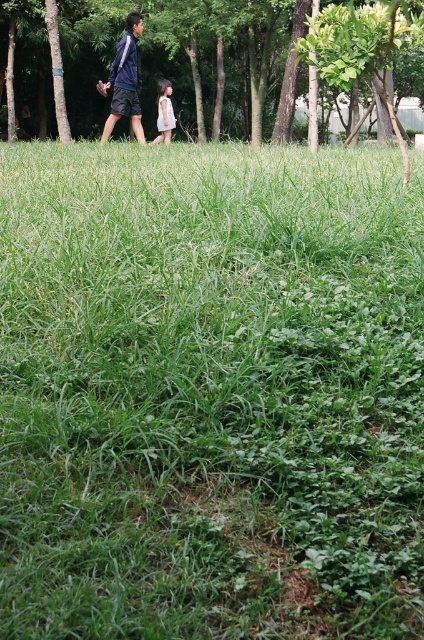
Is green leafy tree at upper center shorter than light pink fabric dress at center?

Correct, green leafy tree at upper center is not as tall as light pink fabric dress at center.

Does green leafy tree at upper center appear under light pink fabric dress at center?

No, green leafy tree at upper center is not below light pink fabric dress at center.

Who is more forward, (209, 80) or (162, 90)?

Point (162, 90) is in front.

This screenshot has width=424, height=640. Find the location of `green leafy tree at upper center`. green leafy tree at upper center is located at coordinates (156, 65).

Who is positioned more to the left, blue fabric jacket at upper left or light pink fabric dress at center?

blue fabric jacket at upper left is more to the left.

Identify the location of blue fabric jacket at upper left. (125, 81).

Locate an element on the screen. Image resolution: width=424 pixels, height=640 pixels. green leafy tree at upper center is located at coordinates pos(156,65).

Is green leafy tree at upper center wider than blue fabric jacket at upper left?

Incorrect, green leafy tree at upper center's width does not surpass blue fabric jacket at upper left's.

Does point (69, 115) come farther from viewer compared to point (106, 90)?

Yes, point (69, 115) is behind point (106, 90).

The width and height of the screenshot is (424, 640). I want to click on green leafy tree at upper center, so click(156, 65).